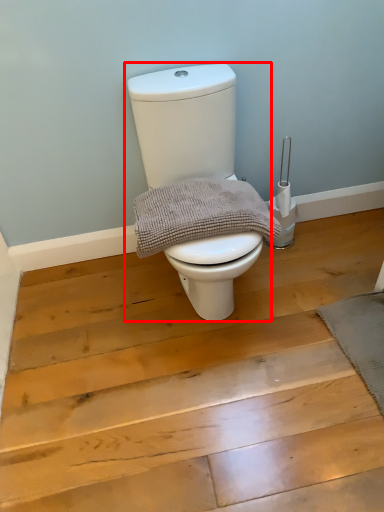
Question: Where is toilet (annotated by the red box) located in relation to material in the image?

Choices:
 (A) left
 (B) right

Answer: (B)